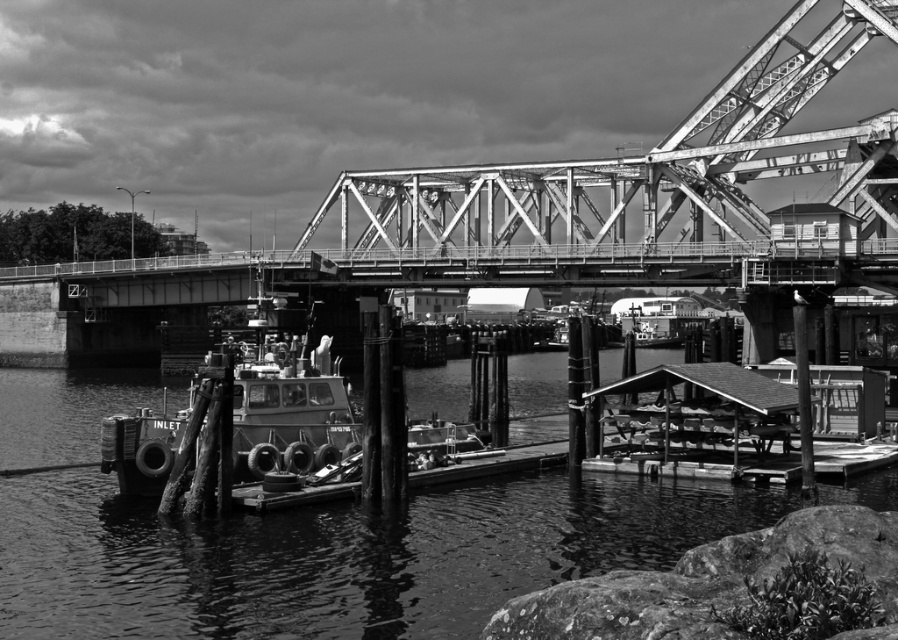
You are a photographer positioned at the waterfront. You want to capture a shot of the metallic boat at center without the smooth water at dock center appearing in the foreground. Is this possible given their positions?

The smooth water at dock center is in front of the metallic boat at center, so it will block the view of the boat. To avoid the water in the foreground, you would need to adjust your position or angle to frame the boat without the water obscuring it.

You are a photographer positioned on the dock. You want to capture a photo of the metallic boat at center without including the smooth water at dock center in the frame. Based on their positions, is this possible? Explain your reasoning.

The smooth water at dock center is to the left of the metallic boat at center. Since the boat is positioned to the right of the water, you can adjust your camera angle or position to frame the boat while excluding the water to its left.

You are an engineer assessing the dock area. You need to determine if the smooth water at dock center can support the weight of the metallic boat at center. Based on their heights, can the water support the boat?

The smooth water at dock center is not as tall as the metallic boat at center, which means the water level is lower than the boat. Since water height typically relates to depth, the water might not be deep enough to support the boat safely. However, water depth alone isn